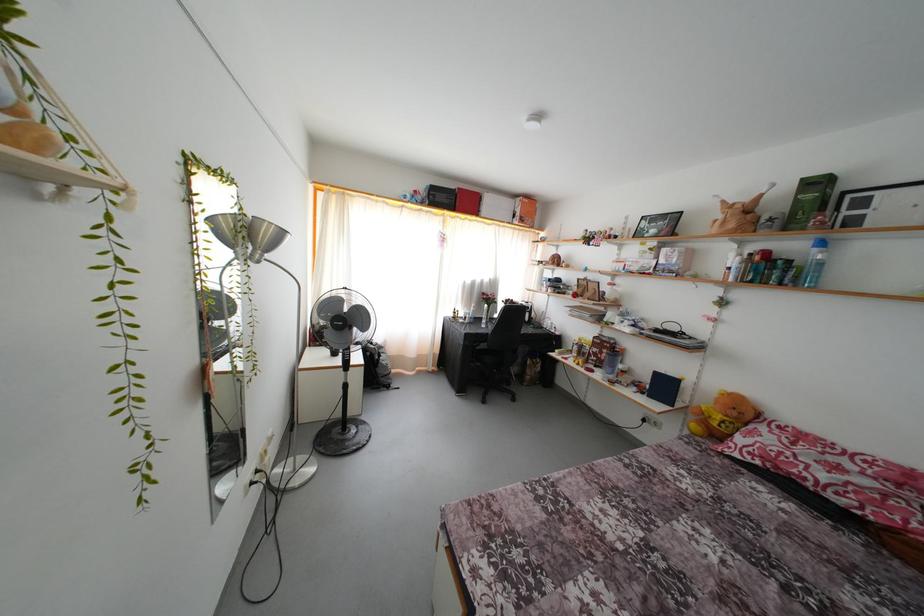
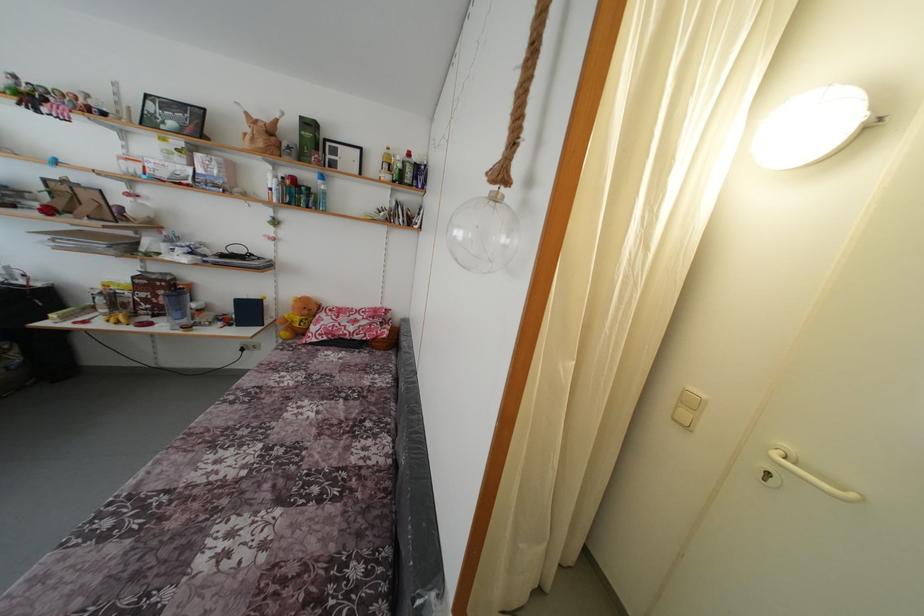
Where in the second image is the point corresponding to the point at 738,419 from the first image?

(310, 317)